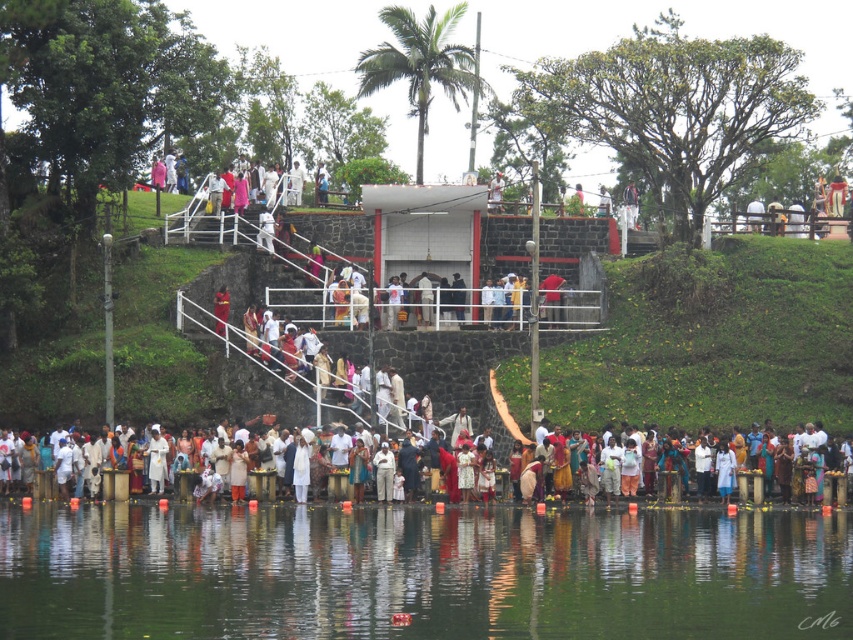
Which is above, red fabric person at center or red fabric cloth at center?

red fabric person at center

What do you see at coordinates (550, 298) in the screenshot? The height and width of the screenshot is (640, 853). I see `red fabric person at center` at bounding box center [550, 298].

Is point (556, 298) more distant than point (218, 310)?

Yes, point (556, 298) is farther from viewer.

Image resolution: width=853 pixels, height=640 pixels. Identify the location of red fabric person at center. (550, 298).

Does point (825, 484) come in front of point (221, 317)?

That is True.

Who is more forward, (x=47, y=474) or (x=225, y=312)?

Point (x=47, y=474) is in front.

Who is more forward, [334,492] or [224,312]?

Point [334,492]

You are a GUI agent. You are given a task and a screenshot of the screen. Output one action in this format:
    pyautogui.click(x=<x>, y=<y>)
    Task: Click on the white clothed people at lower center
    
    Given the screenshot: What is the action you would take?
    pyautogui.click(x=827, y=476)

Which is above, transparent water at lower center or red fabric person at center?

red fabric person at center is above.

Between point (492, 544) and point (538, 288), which one is positioned in front?

Positioned in front is point (492, 544).

Is point (367, 556) positioned in front of point (561, 285)?

Yes, it is.

Identify the location of transparent water at lower center. Image resolution: width=853 pixels, height=640 pixels. (421, 572).